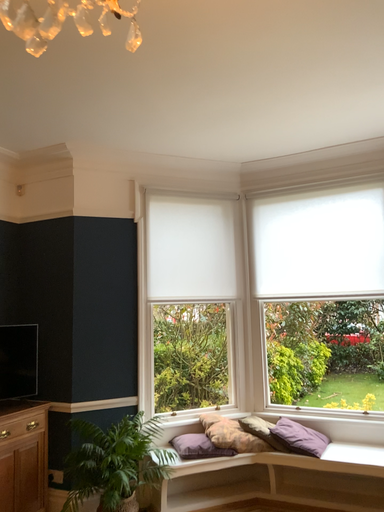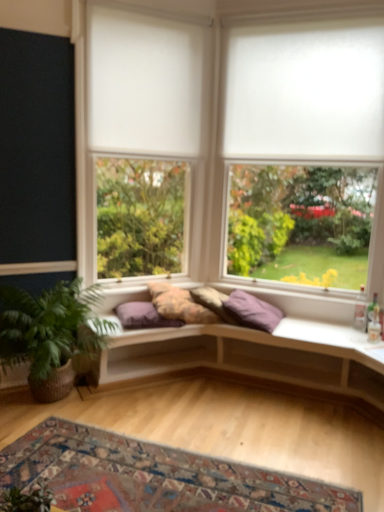
Question: How did the camera likely rotate when shooting the video?

Choices:
 (A) rotated downward
 (B) rotated upward

Answer: (A)